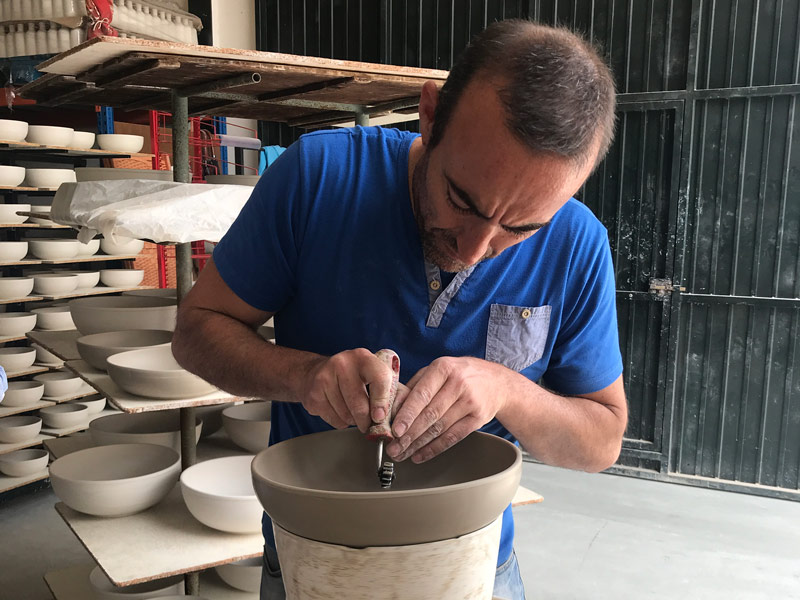
At what (x,y) coordinates should I click in order to perform the action: click on floor. Please return your answer as a coordinate pair (x, y). Looking at the image, I should click on (653, 518).